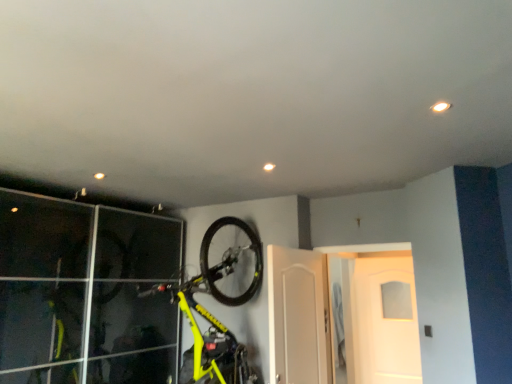
Question: In which direction should I rotate to look at white glossy door at center, the second door viewed from the front?

Choices:
 (A) right
 (B) left

Answer: (A)

Question: Is yellow matte bicycle at upper center at the right side of white glossy door at center, the third door when ordered from front to back?

Choices:
 (A) yes
 (B) no

Answer: (B)

Question: Is yellow matte bicycle at upper center not close to white glossy door at center, which is the 1th door in back-to-front order?

Choices:
 (A) no
 (B) yes

Answer: (B)

Question: Is white glossy door at center, the third door when ordered from front to back, at the back of yellow matte bicycle at upper center?

Choices:
 (A) yes
 (B) no

Answer: (A)

Question: From a real-world perspective, is yellow matte bicycle at upper center physically above white glossy door at center, which is the 1th door in back-to-front order?

Choices:
 (A) yes
 (B) no

Answer: (A)

Question: Does yellow matte bicycle at upper center appear on the left side of white glossy door at center, the third door when ordered from front to back?

Choices:
 (A) yes
 (B) no

Answer: (A)

Question: Is yellow matte bicycle at upper center smaller than white glossy door at center, the third door when ordered from front to back?

Choices:
 (A) yes
 (B) no

Answer: (B)

Question: Does white glossy door at center, arranged as the 2th door when viewed from the back, have a smaller size compared to white glossy door at center, which is the 1th door in back-to-front order?

Choices:
 (A) no
 (B) yes

Answer: (A)

Question: Can you confirm if white glossy door at center, the second door viewed from the front, is bigger than white glossy door at center, the third door when ordered from front to back?

Choices:
 (A) yes
 (B) no

Answer: (A)

Question: Is the position of white glossy door at center, the second door viewed from the front, less distant than that of white glossy door at center, which is the 1th door in back-to-front order?

Choices:
 (A) yes
 (B) no

Answer: (A)

Question: Is white glossy door at center, the second door viewed from the front, surrounding white glossy door at center, the third door when ordered from front to back?

Choices:
 (A) yes
 (B) no

Answer: (B)

Question: Is white glossy door at center, the second door viewed from the front, thinner than white glossy door at center, the third door when ordered from front to back?

Choices:
 (A) yes
 (B) no

Answer: (B)

Question: Considering the relative sizes of white glossy door at center, arranged as the 2th door when viewed from the back, and white glossy door at center, which is the 1th door in back-to-front order, in the image provided, is white glossy door at center, arranged as the 2th door when viewed from the back, taller than white glossy door at center, which is the 1th door in back-to-front order,?

Choices:
 (A) yes
 (B) no

Answer: (B)

Question: Does white glossy door at center, the third door when ordered from front to back, lie in front of white glossy door at center, arranged as the 2th door when viewed from the back?

Choices:
 (A) yes
 (B) no

Answer: (B)